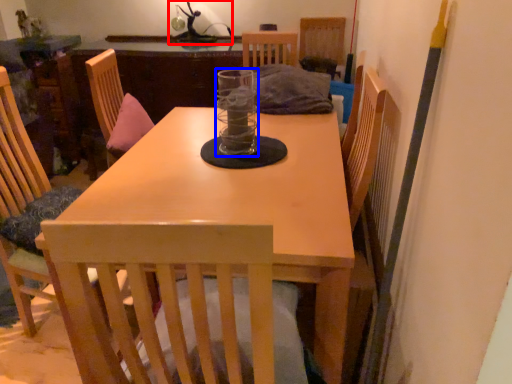
Question: Which object is closer to the camera taking this photo, table lamp (highlighted by a red box) or glass jar (highlighted by a blue box)?

Choices:
 (A) table lamp
 (B) glass jar

Answer: (B)